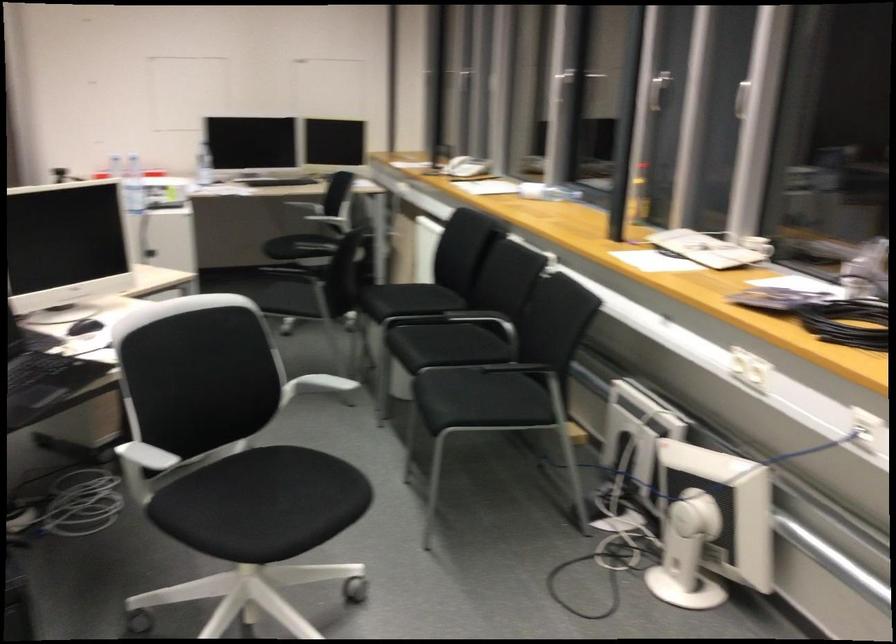
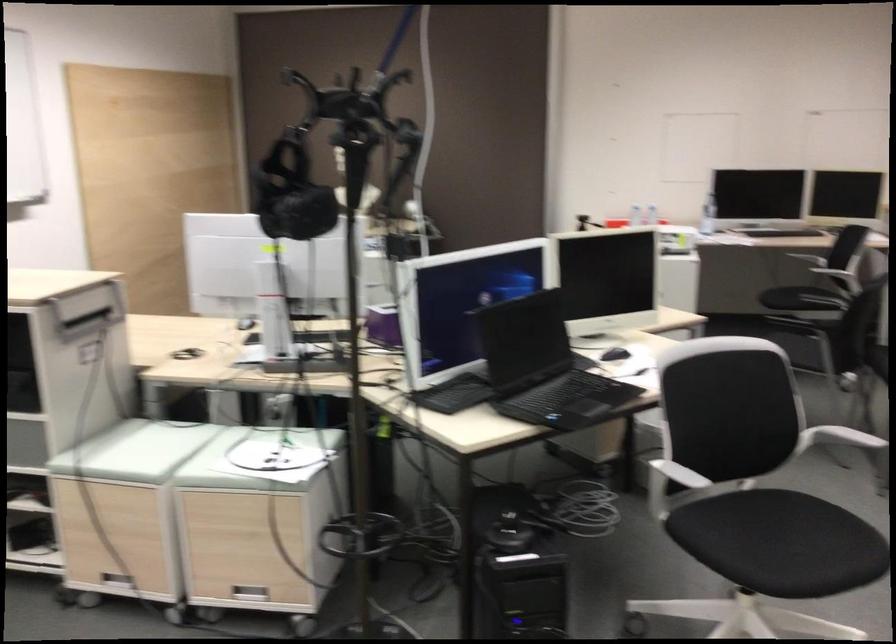
Find the pixel in the second image that matches (x=142, y=460) in the first image.

(679, 474)